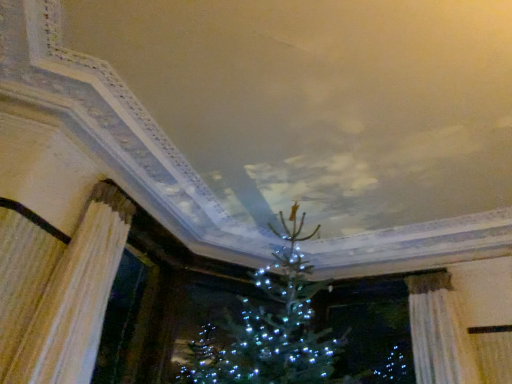
At what (x,y) coordinates should I click in order to perform the action: click on white marble curtain at left. Please return your answer as a coordinate pair (x, y). Looking at the image, I should click on (75, 297).

Describe the element at coordinates (75, 297) in the screenshot. I see `white marble curtain at left` at that location.

You are a GUI agent. You are given a task and a screenshot of the screen. Output one action in this format:
    pyautogui.click(x=<x>, y=<y>)
    Task: Click on the white marble curtain at left
    This screenshot has height=384, width=512.
    Given the screenshot: What is the action you would take?
    pyautogui.click(x=75, y=297)